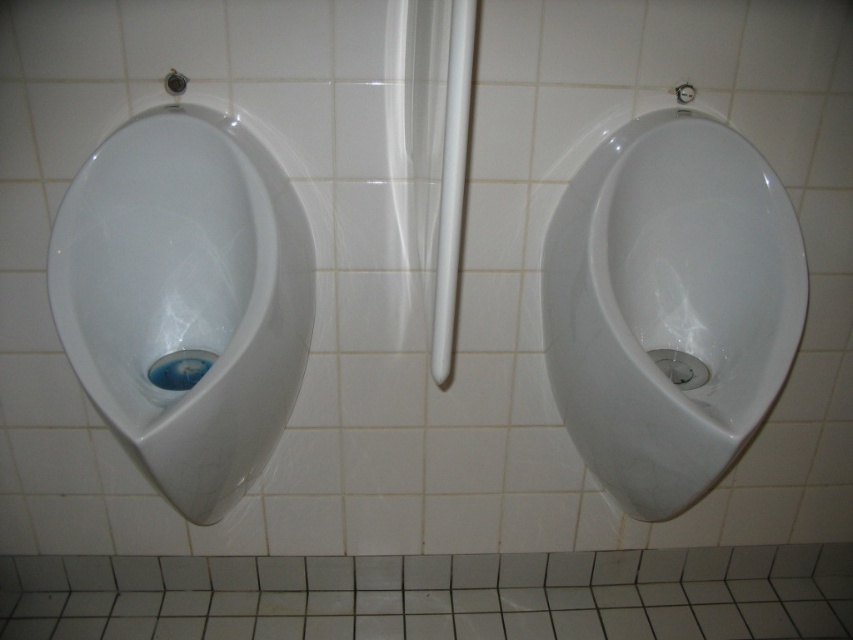
Question: Which of the following is the closest to the observer?

Choices:
 (A) white glossy urinal at left
 (B) white glossy urinal at center

Answer: (A)

Question: Considering the relative positions of white glossy urinal at center and white glossy urinal at left in the image provided, where is white glossy urinal at center located with respect to white glossy urinal at left?

Choices:
 (A) right
 (B) left

Answer: (A)

Question: Can you confirm if white glossy urinal at center is bigger than white glossy urinal at left?

Choices:
 (A) no
 (B) yes

Answer: (B)

Question: Is white glossy urinal at center smaller than white glossy urinal at left?

Choices:
 (A) no
 (B) yes

Answer: (A)